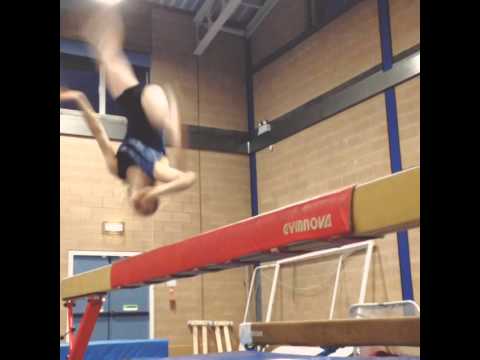
Where is `gymnasium door`? gymnasium door is located at coordinates (121, 325), (97, 327).